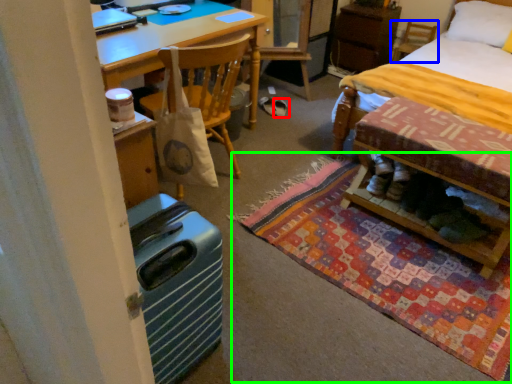
Question: Which is farther away from footwear (highlighted by a red box)? chair (highlighted by a blue box) or mat (highlighted by a green box)?

Choices:
 (A) chair
 (B) mat

Answer: (A)